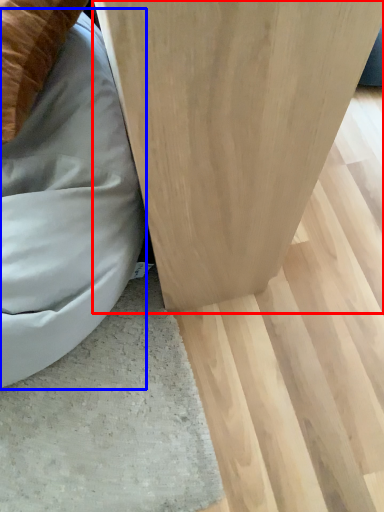
Question: Which point is further to the camera, furniture (highlighted by a red box) or bean bag chair (highlighted by a blue box)?

Choices:
 (A) furniture
 (B) bean bag chair

Answer: (B)